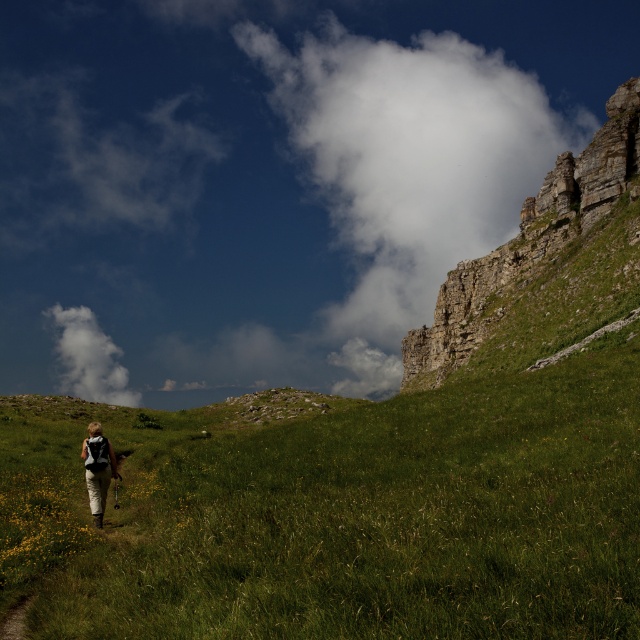
You are a photographer capturing this scene. You want to focus on the khaki pants at center while ensuring the white fluffy cloud at upper left remains visible in the frame. Can you adjust your camera angle to make both elements visible without moving either object?

The white fluffy cloud at upper left is further to the viewer than the khaki pants at center. Therefore, adjusting the camera angle slightly downward would allow the photographer to keep both the khaki pants at center and the white fluffy cloud at upper left within the frame while maintaining their visibility.

You are a hiker standing on the grassy hillside. You notice the rugged stone cliff at upper right and the white fluffy cloud at upper left. Which object is higher in the sky?

The rugged stone cliff at upper right is taller than the white fluffy cloud at upper left, so the cliff is higher in the sky.

You are a photographer trying to capture the hiker in the scene. You want to ensure that both the white fluffy cloud at upper center and the khaki pants at center are visible in the frame. Which object should you focus on to make sure both are in the shot?

The white fluffy cloud at upper center is larger in size than the khaki pants at center, so focusing on the larger white fluffy cloud at upper center will ensure both are visible in the frame.